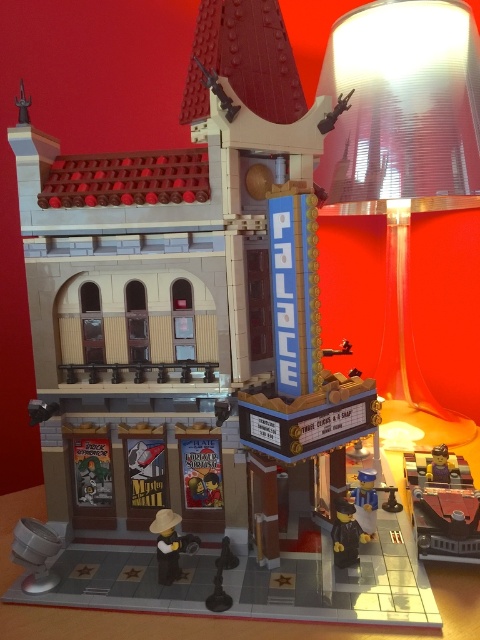
Between brown matte hat at lower center and blue plastic toy at center, which one has less height?

blue plastic toy at center

In the scene shown: Is brown matte hat at lower center thinner than blue plastic toy at center?

In fact, brown matte hat at lower center might be wider than blue plastic toy at center.

Which is in front, point (169, 524) or point (351, 496)?

Point (169, 524) is in front.

The height and width of the screenshot is (640, 480). What are the coordinates of `brown matte hat at lower center` in the screenshot? It's located at (169, 545).

This screenshot has width=480, height=640. I want to click on metallic gold car at lower right, so click(443, 506).

This screenshot has height=640, width=480. Identify the location of metallic gold car at lower right. (443, 506).

Based on the photo, is dark gray plastic figure at center to the right of blue plastic toy at center from the viewer's perspective?

In fact, dark gray plastic figure at center is to the left of blue plastic toy at center.

Who is higher up, dark gray plastic figure at center or blue plastic toy at center?

blue plastic toy at center is higher up.

Locate an element on the screen. dark gray plastic figure at center is located at coordinates (346, 532).